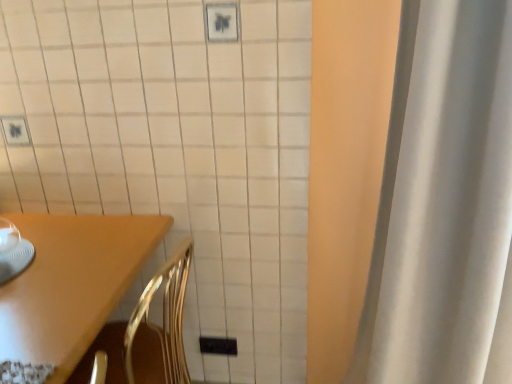
Question: From a real-world perspective, is white fabric curtain at right located higher than wooden table at lower left?

Choices:
 (A) no
 (B) yes

Answer: (B)

Question: Can you confirm if white fabric curtain at right is bigger than wooden table at lower left?

Choices:
 (A) no
 (B) yes

Answer: (A)

Question: Can you confirm if white fabric curtain at right is wider than wooden table at lower left?

Choices:
 (A) no
 (B) yes

Answer: (A)

Question: Is wooden table at lower left at the back of white fabric curtain at right?

Choices:
 (A) no
 (B) yes

Answer: (A)

Question: Can we say white fabric curtain at right lies outside wooden table at lower left?

Choices:
 (A) yes
 (B) no

Answer: (A)

Question: Is wooden table at lower left completely or partially inside white fabric curtain at right?

Choices:
 (A) yes
 (B) no

Answer: (B)

Question: Is wooden table at lower left smaller than white fabric curtain at right?

Choices:
 (A) no
 (B) yes

Answer: (A)

Question: Can you see wooden table at lower left touching white fabric curtain at right?

Choices:
 (A) no
 (B) yes

Answer: (A)

Question: From a real-world perspective, is wooden table at lower left positioned over white fabric curtain at right based on gravity?

Choices:
 (A) no
 (B) yes

Answer: (A)

Question: From a real-world perspective, is wooden table at lower left physically below white fabric curtain at right?

Choices:
 (A) yes
 (B) no

Answer: (A)

Question: Is wooden table at lower left far from white fabric curtain at right?

Choices:
 (A) yes
 (B) no

Answer: (B)

Question: Is wooden table at lower left closer to camera compared to white fabric curtain at right?

Choices:
 (A) no
 (B) yes

Answer: (A)

Question: Is wooden table at lower left in front of or behind white fabric curtain at right in the image?

Choices:
 (A) behind
 (B) front

Answer: (A)